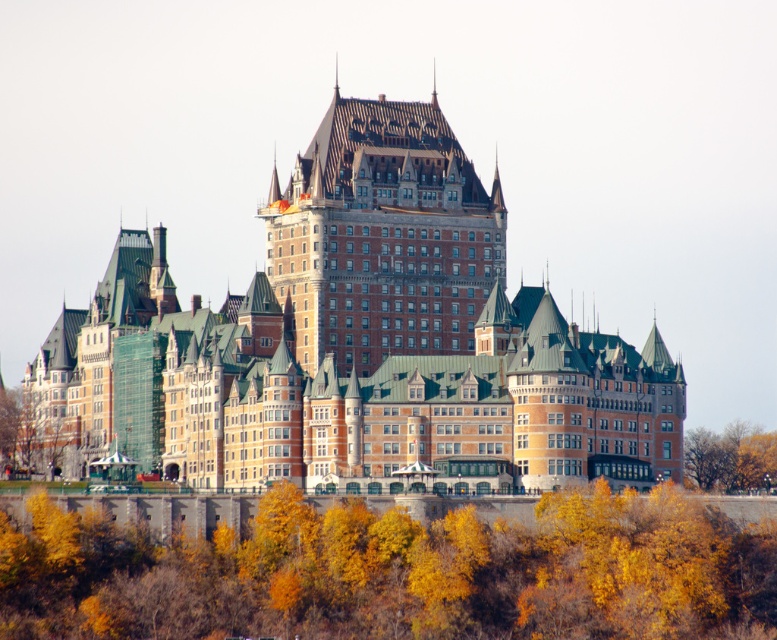
Question: Can you confirm if brown stone castle at center is wider than yellow leafy trees at center?

Choices:
 (A) no
 (B) yes

Answer: (B)

Question: Based on their relative distances, which object is farther from the yellow-green leaves at lower right?

Choices:
 (A) brown stone castle at center
 (B) yellow leafy trees at center
 (C) brown wooden tower at center

Answer: (B)

Question: Among these objects, which one is nearest to the camera?

Choices:
 (A) brown stone castle at center
 (B) green matte tree at lower left
 (C) brown wooden tower at center

Answer: (A)

Question: Can you confirm if brown stone castle at center is wider than yellow leafy trees at center?

Choices:
 (A) no
 (B) yes

Answer: (B)

Question: Is brown stone castle at center to the left of brown wooden tower at center from the viewer's perspective?

Choices:
 (A) no
 (B) yes

Answer: (A)

Question: Among these objects, which one is farthest from the camera?

Choices:
 (A) yellow leafy trees at center
 (B) brown stone castle at center

Answer: (B)